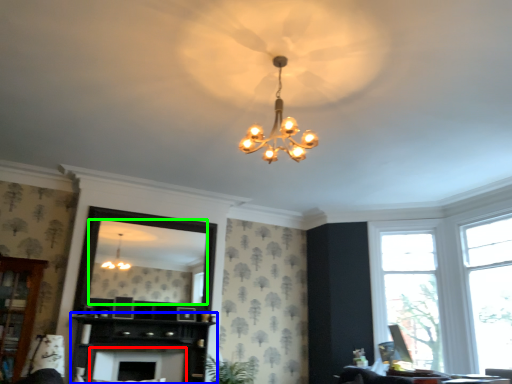
Question: Based on their relative distances, which object is nearer to fireplace (highlighted by a red box)? Choose from dresser (highlighted by a blue box) and mirror (highlighted by a green box).

Choices:
 (A) dresser
 (B) mirror

Answer: (A)